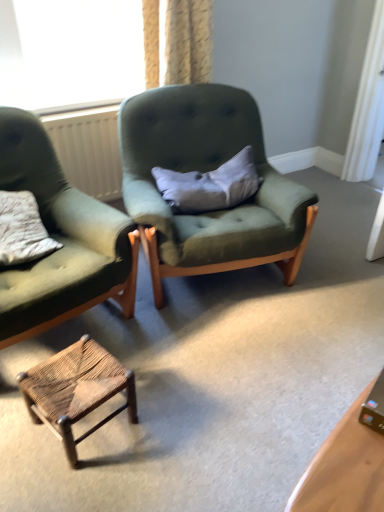
Question: From the image's perspective, is rustic woven stool at lower center above matte green fabric chair at left, acting as the 2th chair starting from the right?

Choices:
 (A) yes
 (B) no

Answer: (B)

Question: Can you confirm if rustic woven stool at lower center is thinner than matte green fabric chair at left, the 1th chair when ordered from left to right?

Choices:
 (A) no
 (B) yes

Answer: (B)

Question: Considering the relative positions of rustic woven stool at lower center and matte green fabric chair at left, the 1th chair when ordered from left to right, in the image provided, is rustic woven stool at lower center in front of matte green fabric chair at left, the 1th chair when ordered from left to right,?

Choices:
 (A) no
 (B) yes

Answer: (A)

Question: From a real-world perspective, is rustic woven stool at lower center beneath matte green fabric chair at left, the 1th chair when ordered from left to right?

Choices:
 (A) yes
 (B) no

Answer: (A)

Question: Is rustic woven stool at lower center positioned behind matte green fabric chair at left, the 1th chair when ordered from left to right?

Choices:
 (A) no
 (B) yes

Answer: (B)

Question: From a real-world perspective, relative to matte green fabric chair at left, the 1th chair when ordered from left to right, is velvet green armchair at center, acting as the 2th chair starting from the left, vertically above or below?

Choices:
 (A) below
 (B) above

Answer: (A)

Question: In terms of width, does velvet green armchair at center, acting as the 2th chair starting from the left, look wider or thinner when compared to matte green fabric chair at left, acting as the 2th chair starting from the right?

Choices:
 (A) wide
 (B) thin

Answer: (A)

Question: Is velvet green armchair at center, acting as the first chair starting from the right, situated inside matte green fabric chair at left, acting as the 2th chair starting from the right, or outside?

Choices:
 (A) inside
 (B) outside

Answer: (B)

Question: From the image's perspective, is velvet green armchair at center, acting as the first chair starting from the right, positioned above or below matte green fabric chair at left, the 1th chair when ordered from left to right?

Choices:
 (A) below
 (B) above

Answer: (B)

Question: In terms of width, does rustic woven stool at lower center look wider or thinner when compared to white plastic radiator at left?

Choices:
 (A) wide
 (B) thin

Answer: (A)

Question: Based on their positions, is rustic woven stool at lower center located to the left or right of white plastic radiator at left?

Choices:
 (A) right
 (B) left

Answer: (A)

Question: Is rustic woven stool at lower center in front of or behind white plastic radiator at left in the image?

Choices:
 (A) front
 (B) behind

Answer: (A)

Question: From the image's perspective, is rustic woven stool at lower center positioned above or below white plastic radiator at left?

Choices:
 (A) below
 (B) above

Answer: (A)

Question: Considering the positions of gray fabric pillow at center and velvet green armchair at center, acting as the 2th chair starting from the left, in the image, is gray fabric pillow at center taller or shorter than velvet green armchair at center, acting as the 2th chair starting from the left,?

Choices:
 (A) tall
 (B) short

Answer: (B)

Question: Would you say gray fabric pillow at center is inside or outside velvet green armchair at center, acting as the 2th chair starting from the left?

Choices:
 (A) outside
 (B) inside

Answer: (B)